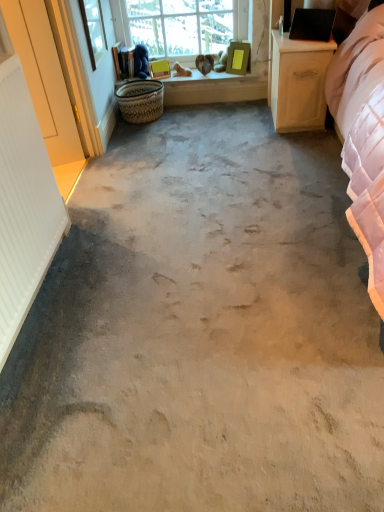
Question: Looking at the image, does white wood screen door at left seem bigger or smaller compared to wooden window sill at upper center?

Choices:
 (A) small
 (B) big

Answer: (B)

Question: Is point (72, 126) closer or farther from the camera than point (266, 75)?

Choices:
 (A) farther
 (B) closer

Answer: (B)

Question: Which is nearer to the clear glass window screen at upper left?

Choices:
 (A) wooden window sill at upper center
 (B) white wood screen door at left
 (C) white ribbed radiator at left
 (D) woven natural basket at center
 (E) light wood/wooden nightstand at right

Answer: (D)

Question: Which is nearer to the light wood/wooden nightstand at right?

Choices:
 (A) wooden window sill at upper center
 (B) woven natural basket at center
 (C) white ribbed radiator at left
 (D) clear glass window at upper center
 (E) clear glass window screen at upper left

Answer: (A)